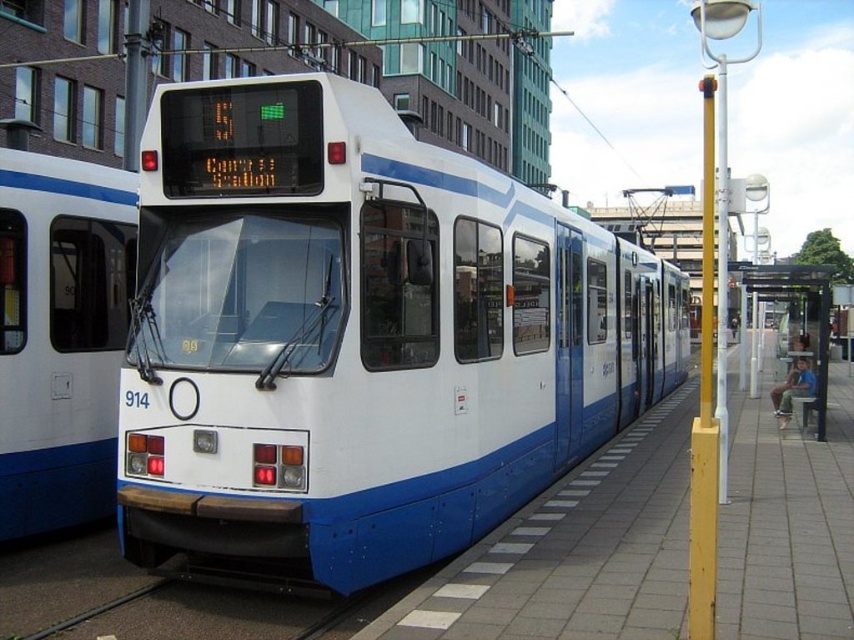
Question: Considering the relative positions of white glossy train at center and transparent plastic bus stop at right in the image provided, where is white glossy train at center located with respect to transparent plastic bus stop at right?

Choices:
 (A) above
 (B) below

Answer: (B)

Question: Can you confirm if white glossy train at center is smaller than white glossy train at left?

Choices:
 (A) no
 (B) yes

Answer: (A)

Question: From the image, what is the correct spatial relationship of white glossy train at center in relation to transparent plastic bus stop at right?

Choices:
 (A) right
 (B) left

Answer: (B)

Question: Which object is farther from the camera taking this photo?

Choices:
 (A) transparent plastic bus stop at right
 (B) white glossy train at left

Answer: (A)

Question: Considering the real-world distances, which object is farthest from the white glossy train at center?

Choices:
 (A) transparent plastic bus stop at right
 (B) white glossy train at left

Answer: (B)

Question: Which object appears closest to the camera in this image?

Choices:
 (A) transparent plastic bus stop at right
 (B) white glossy train at center

Answer: (B)